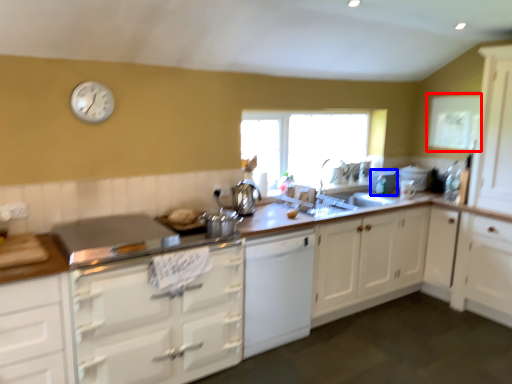
Question: Which object is closer to the camera taking this photo, window screen (highlighted by a red box) or appliance (highlighted by a blue box)?

Choices:
 (A) window screen
 (B) appliance

Answer: (A)